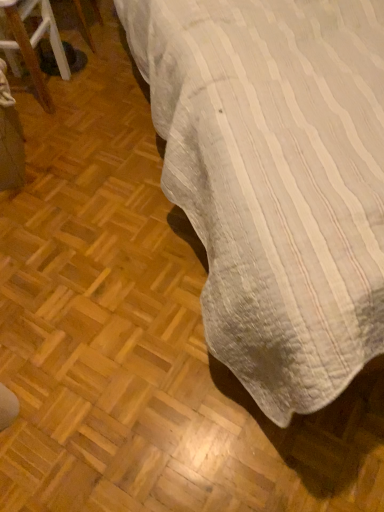
This screenshot has height=512, width=384. In order to click on black fabric bag at left in this screenshot , I will do `click(34, 42)`.

The image size is (384, 512). Describe the element at coordinates (34, 42) in the screenshot. I see `black fabric bag at left` at that location.

I want to click on white striped fabric at upper right, so click(276, 180).

What do you see at coordinates (276, 180) in the screenshot? I see `white striped fabric at upper right` at bounding box center [276, 180].

Measure the distance between point (311, 211) and camera.

The distance of point (311, 211) from camera is 28.82 inches.

Measure the distance between white striped fabric at upper right and camera.

A distance of 25.06 inches exists between white striped fabric at upper right and camera.

Identify the location of black fabric bag at left. (34, 42).

Can you confirm if white striped fabric at upper right is positioned to the right of black fabric bag at left?

Indeed, white striped fabric at upper right is positioned on the right side of black fabric bag at left.

Is the depth of white striped fabric at upper right less than that of black fabric bag at left?

Result: Yes, white striped fabric at upper right is closer to the camera.

Which is closer, (x=345, y=10) or (x=42, y=36)?

Positioned in front is point (x=345, y=10).

From the image's perspective, relative to black fabric bag at left, is white striped fabric at upper right above or below?

From the image's perspective, white striped fabric at upper right appears below black fabric bag at left.

From a real-world perspective, between white striped fabric at upper right and black fabric bag at left, who is vertically lower?

From a 3D spatial view, black fabric bag at left is below.

Does white striped fabric at upper right have a greater width compared to black fabric bag at left?

Yes.

Can you confirm if white striped fabric at upper right is shorter than black fabric bag at left?

No, white striped fabric at upper right is not shorter than black fabric bag at left.

Who is bigger, white striped fabric at upper right or black fabric bag at left?

Bigger between the two is white striped fabric at upper right.

Is black fabric bag at left completely or partially inside white striped fabric at upper right?

No.

Is white striped fabric at upper right far from black fabric bag at left?

They are positioned close to each other.

Could you tell me if white striped fabric at upper right is facing black fabric bag at left?

No, white striped fabric at upper right is not facing towards black fabric bag at left.

Identify the location of furniture above the white striped fabric at upper right (from the image's perspective). This screenshot has height=512, width=384. (34, 42).

Which is more to the left, black fabric bag at left or white striped fabric at upper right?

black fabric bag at left.

Does black fabric bag at left come behind white striped fabric at upper right?

Yes, black fabric bag at left is behind white striped fabric at upper right.

Considering the positions of points (46, 110) and (381, 160), is point (46, 110) farther from camera compared to point (381, 160)?

Yes.

From the image's perspective, between black fabric bag at left and white striped fabric at upper right, who is located below?

white striped fabric at upper right.

From a real-world perspective, which is physically above, black fabric bag at left or white striped fabric at upper right?

white striped fabric at upper right, from a real-world perspective.

Consider the image. Considering the relative sizes of black fabric bag at left and white striped fabric at upper right in the image provided, is black fabric bag at left wider than white striped fabric at upper right?

No.

In terms of height, does black fabric bag at left look taller or shorter compared to white striped fabric at upper right?

black fabric bag at left is shorter than white striped fabric at upper right.

Which of these two, black fabric bag at left or white striped fabric at upper right, is smaller?

With smaller size is black fabric bag at left.

Is white striped fabric at upper right surrounded by black fabric bag at left?

Actually, white striped fabric at upper right is outside black fabric bag at left.

Can you see black fabric bag at left touching white striped fabric at upper right?

No, black fabric bag at left is not next to white striped fabric at upper right.

Looking at this image, is black fabric bag at left oriented towards white striped fabric at upper right?

Yes.

How different are the orientations of black fabric bag at left and white striped fabric at upper right in degrees?

black fabric bag at left and white striped fabric at upper right are facing 66.3 degrees away from each other.

The width and height of the screenshot is (384, 512). I want to click on table lying in front of the black fabric bag at left, so click(x=276, y=180).

Identify the location of table that is above the black fabric bag at left (from a real-world perspective). The width and height of the screenshot is (384, 512). (276, 180).

At what (x,y) coordinates should I click in order to perform the action: click on furniture located underneath the white striped fabric at upper right (from a real-world perspective). Please return your answer as a coordinate pair (x, y). Looking at the image, I should click on (34, 42).